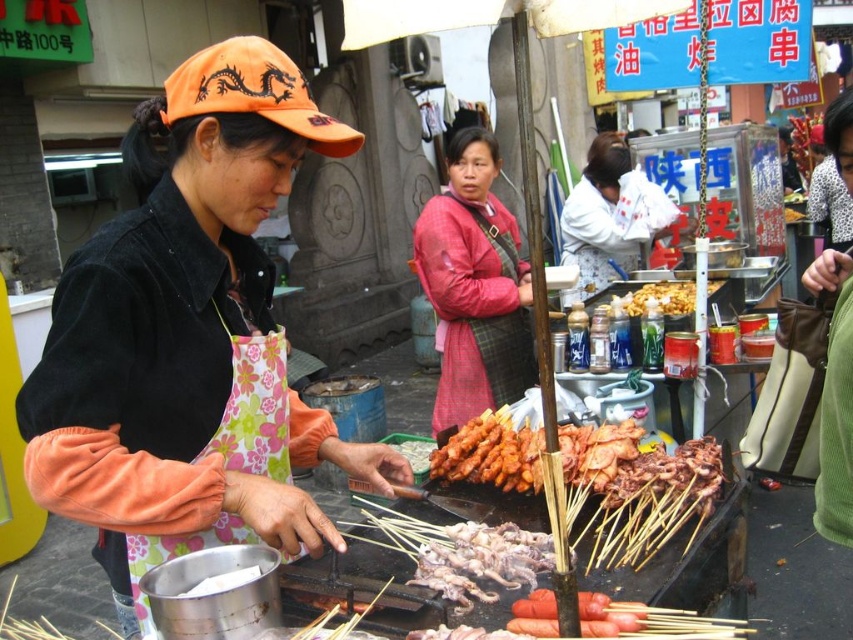
Based on the photo, you are a customer at the street food stall and you want to grab the golden crispy fried chicken at center without touching the white cotton shirt at center. Is this possible?

The white cotton shirt at center is positioned on the right side of golden crispy fried chicken at center, so you can grab the golden crispy fried chicken at center from the left side to avoid touching the white cotton shirt at center.

You are a customer at the street stall and want to grab the golden crispy fried chicken at center before the chef in the orange fabric apron at center notices you. Can you reach it without moving closer to the grill?

The orange fabric apron at center is closer to the viewer than golden crispy fried chicken at center, so the golden crispy fried chicken at center is farther away. Since you are already at the same position as the apron, you would need to move closer to reach the chicken, making it hard to grab without the chef noticing.